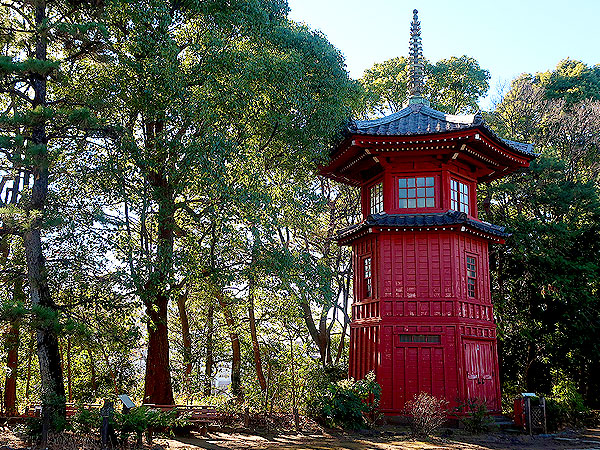
You are a GUI agent. You are given a task and a screenshot of the screen. Output one action in this format:
    pyautogui.click(x=<x>, y=<y>)
    Task: Click on the middle window
    The image size is (600, 450).
    Given the screenshot: What is the action you would take?
    pyautogui.click(x=420, y=192)